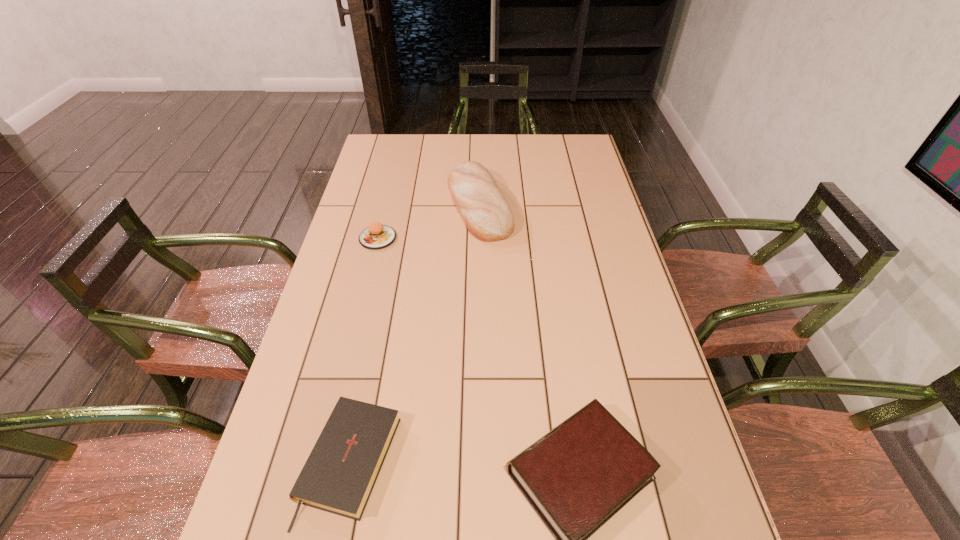
You are a GUI agent. You are given a task and a screenshot of the screen. Output one action in this format:
    pyautogui.click(x=<x>, y=<y>)
    Task: Click on the vacant area between the left Bible and the tallest object
    
    Given the screenshot: What is the action you would take?
    pyautogui.click(x=415, y=334)

You are a GUI agent. You are given a task and a screenshot of the screen. Output one action in this format:
    pyautogui.click(x=<x>, y=<y>)
    Task: Click on the vacant space that's between the left Bible and the patty
    The height and width of the screenshot is (540, 960).
    Given the screenshot: What is the action you would take?
    pyautogui.click(x=364, y=350)

You are a GUI agent. You are given a task and a screenshot of the screen. Output one action in this format:
    pyautogui.click(x=<x>, y=<y>)
    Task: Click on the free point between the tallest object and the patty
    The width and height of the screenshot is (960, 540).
    Given the screenshot: What is the action you would take?
    pyautogui.click(x=429, y=221)

Select which object appears as the third closest to the shorter Bible. Please provide its 2D coordinates. Your answer should be formatted as a tuple, i.e. [(x, y)], where the tuple contains the x and y coordinates of a point satisfying the conditions above.

[(487, 215)]

Locate an element on the screen. Image resolution: width=960 pixels, height=540 pixels. object that ranks as the second closest to the shorter Bible is located at coordinates (377, 236).

The height and width of the screenshot is (540, 960). I want to click on free region that satisfies the following two spatial constraints: 1. on the front side of the patty; 2. on the left side of the shorter Bible, so click(x=323, y=463).